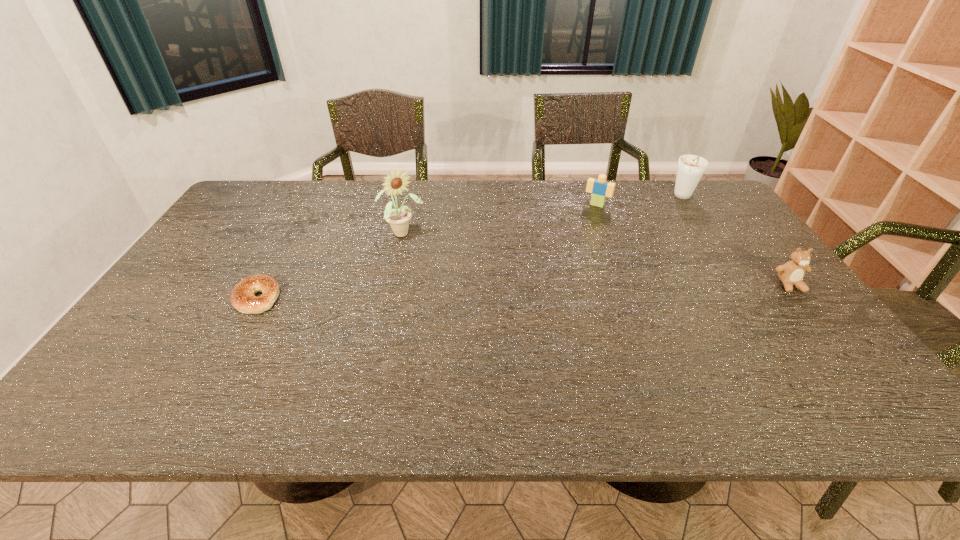
The height and width of the screenshot is (540, 960). Find the location of `free space located on the face of the Lego`. free space located on the face of the Lego is located at coordinates (556, 273).

This screenshot has width=960, height=540. In order to click on free space located 0.070m on the face of the Lego in this screenshot , I will do click(587, 219).

The height and width of the screenshot is (540, 960). I want to click on free space located 0.120m on the face of the Lego, so click(x=582, y=227).

Where is `vacant space located on the drink side of the second object from right to left`? vacant space located on the drink side of the second object from right to left is located at coordinates (633, 253).

Identify the location of vacant space situated on the drink side of the second object from right to left. (x=628, y=258).

Identify the location of free space located on the drink side of the second object from right to left. The width and height of the screenshot is (960, 540). (631, 254).

Where is `vacant space situated 0.230m on the front-facing side of the sunflower`? This screenshot has width=960, height=540. vacant space situated 0.230m on the front-facing side of the sunflower is located at coordinates (452, 282).

Locate an element on the screen. vacant region located on the front-facing side of the sunflower is located at coordinates (478, 311).

This screenshot has height=540, width=960. Identify the location of free point located 0.340m on the front-facing side of the sunflower. (473, 306).

Identify the location of Lego located at the far edge. (600, 188).